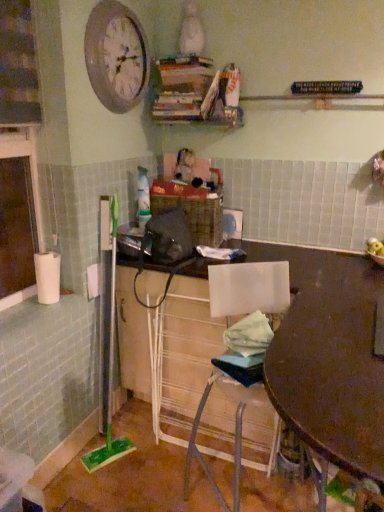
Question: Should I look upward or downward to see wooden table at center?

Choices:
 (A) up
 (B) down

Answer: (B)

Question: Is wooden table at center located within matte brown desk at center?

Choices:
 (A) yes
 (B) no

Answer: (B)

Question: Could you tell me if matte brown desk at center is turned towards wooden table at center?

Choices:
 (A) no
 (B) yes

Answer: (B)

Question: From the image's perspective, is matte brown desk at center located above wooden table at center?

Choices:
 (A) no
 (B) yes

Answer: (B)

Question: From a real-world perspective, is matte brown desk at center below wooden table at center?

Choices:
 (A) no
 (B) yes

Answer: (B)

Question: Considering the relative positions of matte brown desk at center and wooden table at center in the image provided, is matte brown desk at center to the right of wooden table at center from the viewer's perspective?

Choices:
 (A) yes
 (B) no

Answer: (B)

Question: Does matte brown desk at center lie behind wooden table at center?

Choices:
 (A) no
 (B) yes

Answer: (B)

Question: Is white plastic chair at lower center aimed at matte brown desk at center?

Choices:
 (A) no
 (B) yes

Answer: (B)

Question: Is white plastic chair at lower center bigger than matte brown desk at center?

Choices:
 (A) yes
 (B) no

Answer: (B)

Question: Is white plastic chair at lower center outside matte brown desk at center?

Choices:
 (A) yes
 (B) no

Answer: (B)

Question: Considering the relative sizes of white plastic chair at lower center and matte brown desk at center in the image provided, is white plastic chair at lower center taller than matte brown desk at center?

Choices:
 (A) yes
 (B) no

Answer: (B)

Question: Is the position of white plastic chair at lower center more distant than that of matte brown desk at center?

Choices:
 (A) yes
 (B) no

Answer: (A)

Question: Can you confirm if white plastic chair at lower center is shorter than matte brown desk at center?

Choices:
 (A) yes
 (B) no

Answer: (A)

Question: Is wooden table at center at the back of wooden clock at upper left?

Choices:
 (A) yes
 (B) no

Answer: (B)